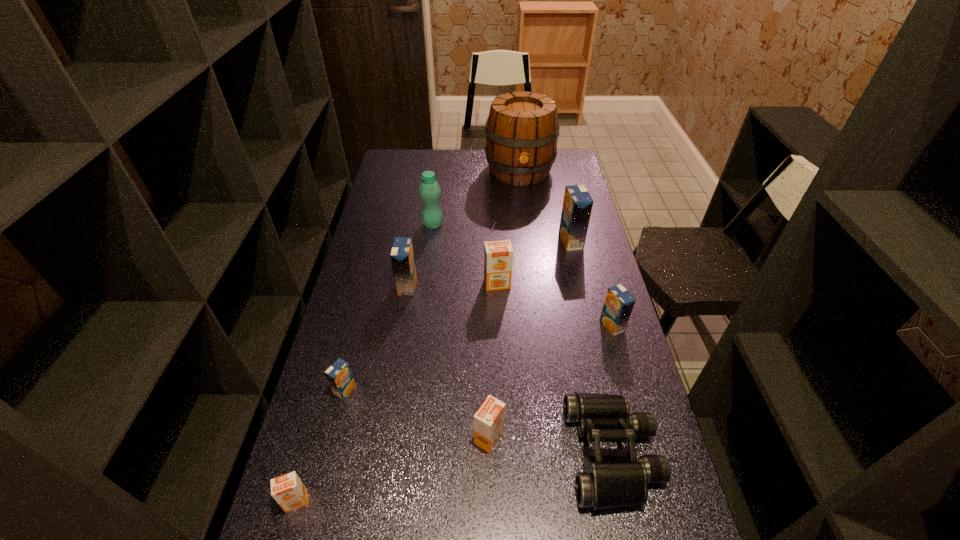
Image resolution: width=960 pixels, height=540 pixels. Identify the location of cider. (522, 129).

Find the location of a particular element. the tallest object is located at coordinates (522, 129).

The image size is (960, 540). What are the coordinates of `the ninth nearest object` in the screenshot? It's located at (430, 192).

Identify the location of the tallest orange juice. This screenshot has height=540, width=960. (577, 205).

Image resolution: width=960 pixels, height=540 pixels. Identify the location of the farthest orange juice. (577, 205).

Locate an element on the screen. the third nearest blue orange_juice is located at coordinates (402, 254).

You are a GUI agent. You are given a task and a screenshot of the screen. Output one action in this format:
    pyautogui.click(x=<x>, y=<y>)
    Task: Click on the second biggest blue orange_juice
    The image size is (960, 540).
    Given the screenshot: What is the action you would take?
    pyautogui.click(x=402, y=254)

Find the location of a particular element. the biggest orange orange juice is located at coordinates (498, 255).

I want to click on the second nearest blue orange_juice, so click(618, 305).

Where is `the sixth farthest object`? the sixth farthest object is located at coordinates (618, 305).